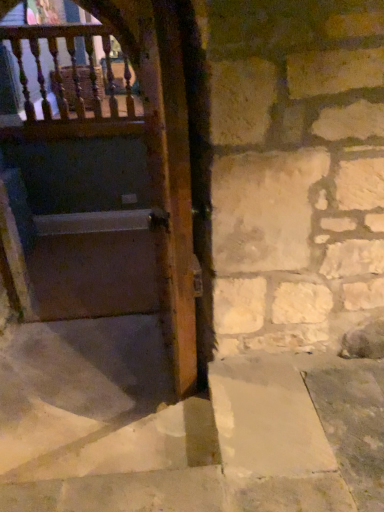
You are a GUI agent. You are given a task and a screenshot of the screen. Output one action in this format:
    pyautogui.click(x=<x>, y=<y>)
    Task: Click on the smooth concrete stairs at center
    
    Given the screenshot: What is the action you would take?
    pyautogui.click(x=157, y=432)

Locate an element on the screen. The height and width of the screenshot is (512, 384). smooth concrete stairs at center is located at coordinates (157, 432).

I want to click on balcony above the smooth concrete stairs at center (from the image's perspective), so click(x=73, y=83).

From the image's perspective, is wooden balusters at upper left located above smooth concrete stairs at center?

Correct, wooden balusters at upper left appears higher than smooth concrete stairs at center in the image.

Between wooden balusters at upper left and smooth concrete stairs at center, which one has larger width?

smooth concrete stairs at center.

How different are the orientations of wooden balusters at upper left and smooth concrete stairs at center in degrees?

wooden balusters at upper left and smooth concrete stairs at center are facing 170 degrees away from each other.

Between smooth concrete stairs at center and wooden balusters at upper left, which one has smaller size?

With smaller size is wooden balusters at upper left.

Can you tell me how much smooth concrete stairs at center and wooden balusters at upper left differ in facing direction?

The angular difference between smooth concrete stairs at center and wooden balusters at upper left is 170 degrees.

Is smooth concrete stairs at center positioned with its back to wooden balusters at upper left?

No, smooth concrete stairs at center is not facing the opposite direction of wooden balusters at upper left.

From the picture: From the image's perspective, is smooth concrete stairs at center beneath wooden balusters at upper left?

Yes.

Is matte wooden door at left aimed at wooden balusters at upper left?

No, matte wooden door at left is not aimed at wooden balusters at upper left.

Is matte wooden door at left next to wooden balusters at upper left and touching it?

No.

Can we say matte wooden door at left lies outside wooden balusters at upper left?

Yes.

In terms of height, does matte wooden door at left look taller or shorter compared to wooden balusters at upper left?

Clearly, matte wooden door at left is taller compared to wooden balusters at upper left.

Is matte wooden door at left with smooth concrete stairs at center?

matte wooden door at left and smooth concrete stairs at center are clearly separated.

Is matte wooden door at left facing away from smooth concrete stairs at center?

matte wooden door at left is not turned away from smooth concrete stairs at center.

Would you say matte wooden door at left is inside or outside smooth concrete stairs at center?

The correct answer is: outside.

Would you say smooth concrete stairs at center is outside matte wooden door at left?

Indeed, smooth concrete stairs at center is completely outside matte wooden door at left.

Identify the location of door above the smooth concrete stairs at center (from the image's perspective). This screenshot has height=512, width=384. (108, 186).

Consider the image. Is smooth concrete stairs at center far from matte wooden door at left?

smooth concrete stairs at center is positioned a significant distance from matte wooden door at left.

Between smooth concrete stairs at center and matte wooden door at left, which one has larger size?

matte wooden door at left.

Could you tell me if wooden balusters at upper left is turned towards matte wooden door at left?

Yes, wooden balusters at upper left is oriented towards matte wooden door at left.

Can you confirm if wooden balusters at upper left is wider than matte wooden door at left?

No, wooden balusters at upper left is not wider than matte wooden door at left.

Where is `balcony on the left of matte wooden door at left`? balcony on the left of matte wooden door at left is located at coordinates (73, 83).

From the image's perspective, is wooden balusters at upper left over matte wooden door at left?

Indeed, from the image's perspective, wooden balusters at upper left is shown above matte wooden door at left.

Locate an element on the screen. This screenshot has height=512, width=384. stairwell that appears below the wooden balusters at upper left (from a real-world perspective) is located at coordinates (157, 432).

Where is `balcony behind the smooth concrete stairs at center`? balcony behind the smooth concrete stairs at center is located at coordinates (73, 83).

Which object lies further to the anchor point matte wooden door at left, smooth concrete stairs at center or wooden balusters at upper left?

smooth concrete stairs at center lies further to matte wooden door at left than the other object.

Based on their spatial positions, is matte wooden door at left or wooden balusters at upper left further from smooth concrete stairs at center?

wooden balusters at upper left lies further to smooth concrete stairs at center than the other object.

Based on their spatial positions, is wooden balusters at upper left or smooth concrete stairs at center further from matte wooden door at left?

smooth concrete stairs at center is further to matte wooden door at left.

From the image, which object appears to be farther from smooth concrete stairs at center, wooden balusters at upper left or matte wooden door at left?

The object further to smooth concrete stairs at center is wooden balusters at upper left.

From the image, which object appears to be nearer to wooden balusters at upper left, smooth concrete stairs at center or matte wooden door at left?

matte wooden door at left is closer to wooden balusters at upper left.

Looking at the image, which one is located closer to wooden balusters at upper left, matte wooden door at left or smooth concrete stairs at center?

The object closer to wooden balusters at upper left is matte wooden door at left.

Locate an element on the screen. The width and height of the screenshot is (384, 512). door between wooden balusters at upper left and smooth concrete stairs at center in the vertical direction is located at coordinates (108, 186).